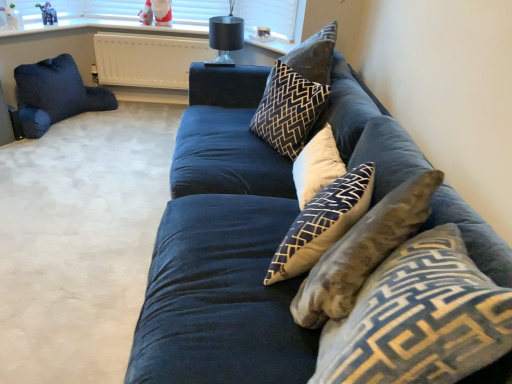
The width and height of the screenshot is (512, 384). Find the location of `empty space that is ontop of white matte radiator at upper center (from a real-world perspective)`. empty space that is ontop of white matte radiator at upper center (from a real-world perspective) is located at coordinates (163, 38).